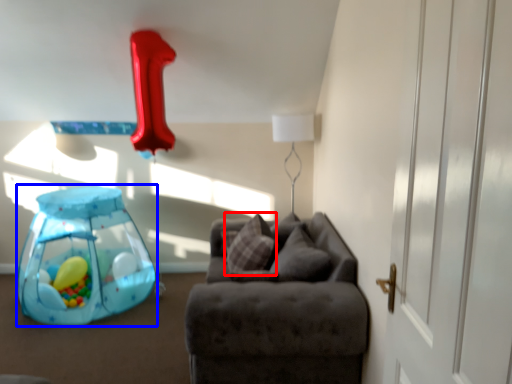
Question: Which object appears farthest to the camera in this image, pillow (highlighted by a red box) or toy (highlighted by a blue box)?

Choices:
 (A) pillow
 (B) toy

Answer: (B)